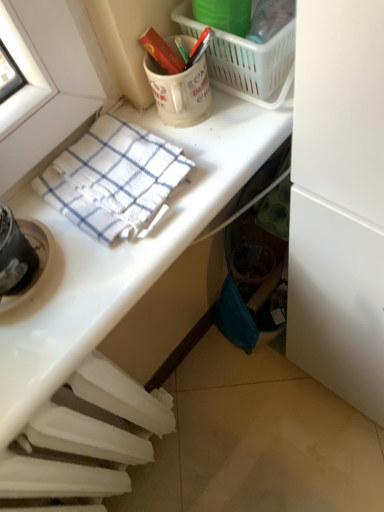
Locate an element on the screen. free location to the right of white checkered towel at upper left is located at coordinates (222, 139).